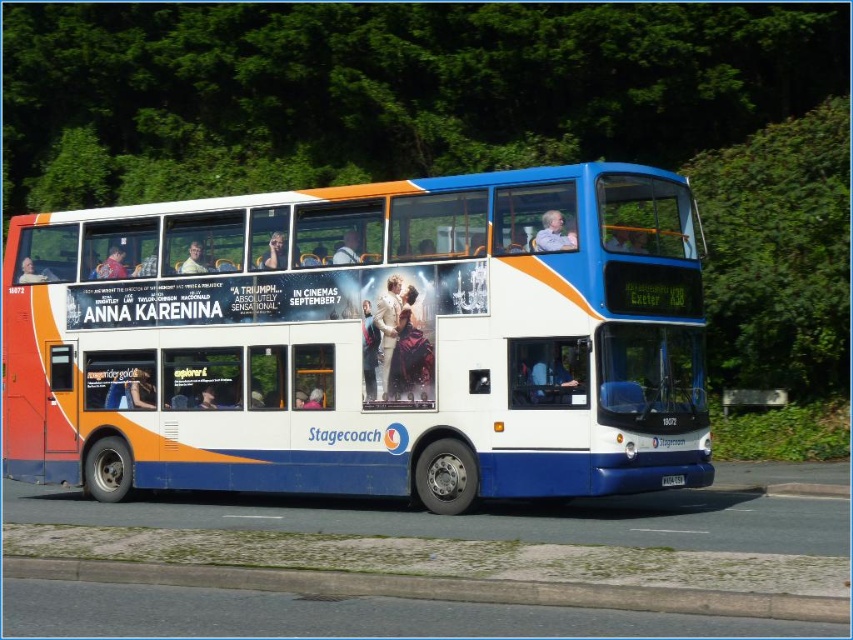
You are a passenger on the double decker bus and want to know if the point at coordinate (537, 349) is behind the point at coordinate (125, 576). Can you confirm this?

Yes, the point at coordinate (537, 349) is behind the point at coordinate (125, 576).